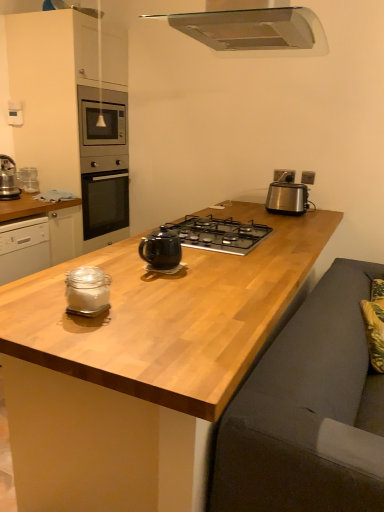
Find the location of `free space to the right of satin silver toaster at right`. free space to the right of satin silver toaster at right is located at coordinates (326, 211).